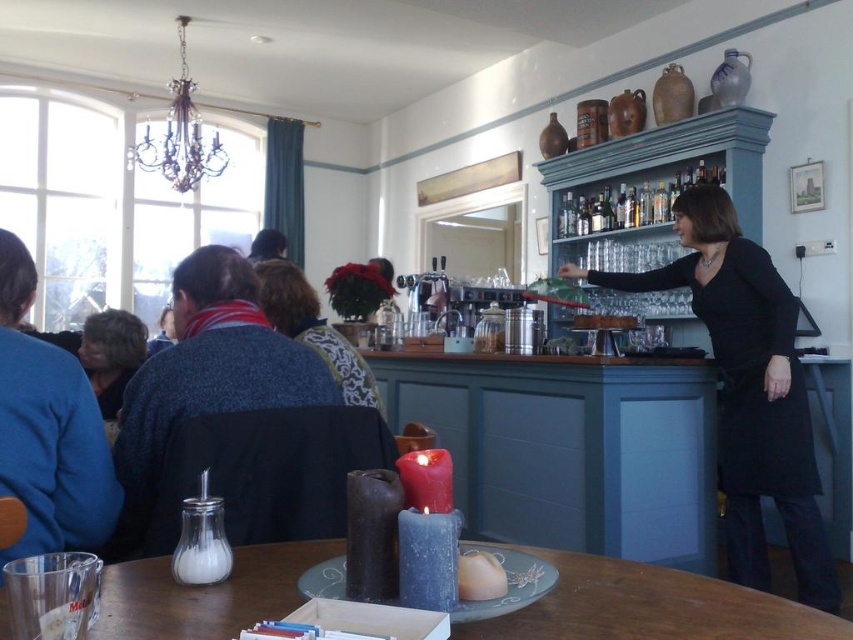
Is wooden table at center positioned in front of blonde hair at left?

Yes, wooden table at center is closer to the viewer.

Can you confirm if wooden table at center is positioned above blonde hair at left?

No, wooden table at center is not above blonde hair at left.

Locate an element on the screen. Image resolution: width=853 pixels, height=640 pixels. wooden table at center is located at coordinates [651, 608].

The image size is (853, 640). I want to click on smooth wooden table at center, so click(x=572, y=449).

Based on the photo, who is more distant from viewer, (834, 540) or (292, 328)?

Point (834, 540)

Where is `smooth wooden table at center`? This screenshot has height=640, width=853. smooth wooden table at center is located at coordinates (572, 449).

Is point (741, 284) in front of point (618, 625)?

No, (741, 284) is further to viewer.

Find the location of `black matte dress at right`. black matte dress at right is located at coordinates (747, 388).